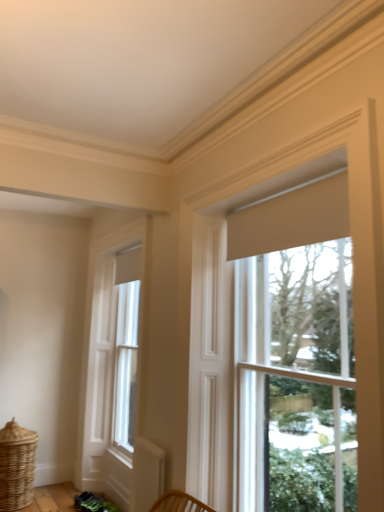
Question: Considering the relative positions of woven natural basket at lower left and beige fabric curtain at upper center in the image provided, is woven natural basket at lower left to the left or to the right of beige fabric curtain at upper center?

Choices:
 (A) right
 (B) left

Answer: (B)

Question: Is point (21, 463) closer or farther from the camera than point (268, 236)?

Choices:
 (A) closer
 (B) farther

Answer: (B)

Question: Which object is positioned closest to the beige fabric curtain at upper center?

Choices:
 (A) matte cream roller shade at right, which appears as the first window when viewed from the front
 (B) white wood window at left, marked as the 1th window in a back-to-front arrangement
 (C) woven natural basket at lower left

Answer: (A)

Question: Considering the real-world distances, which object is closest to the white wood window at left, which is the 2th window in front-to-back order?

Choices:
 (A) beige fabric curtain at upper center
 (B) woven natural basket at lower left
 (C) matte cream roller shade at right, which is the 1th window from right to left

Answer: (B)